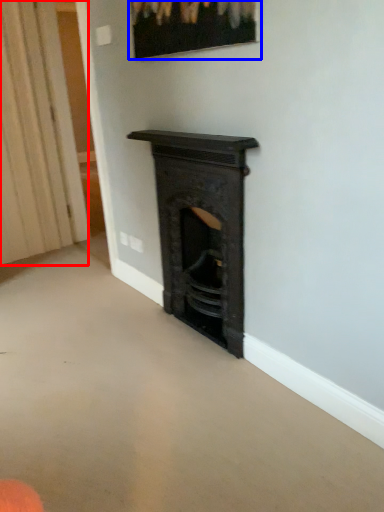
Question: Which of the following is the farthest to the observer, curtain (highlighted by a red box) or picture frame (highlighted by a blue box)?

Choices:
 (A) curtain
 (B) picture frame

Answer: (A)